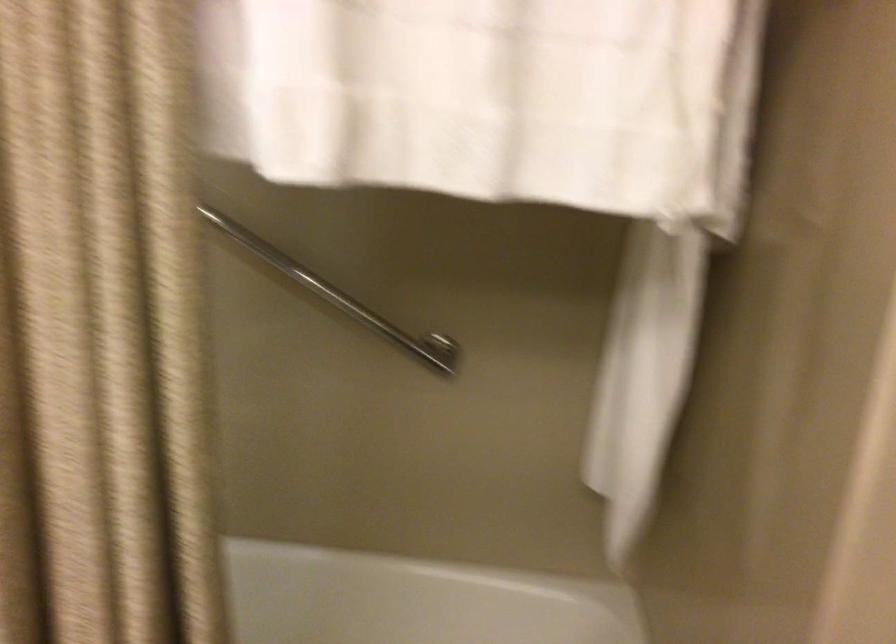
Image resolution: width=896 pixels, height=644 pixels. What do you see at coordinates (340, 297) in the screenshot?
I see `the metal grab bar` at bounding box center [340, 297].